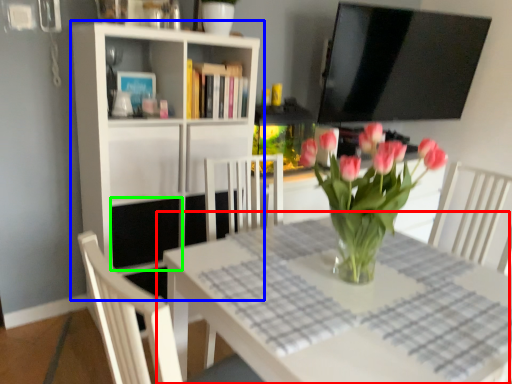
Question: Which is nearer to the table (highlighted by a red box)? shelf (highlighted by a blue box) or shelf (highlighted by a green box).

Choices:
 (A) shelf
 (B) shelf

Answer: (A)